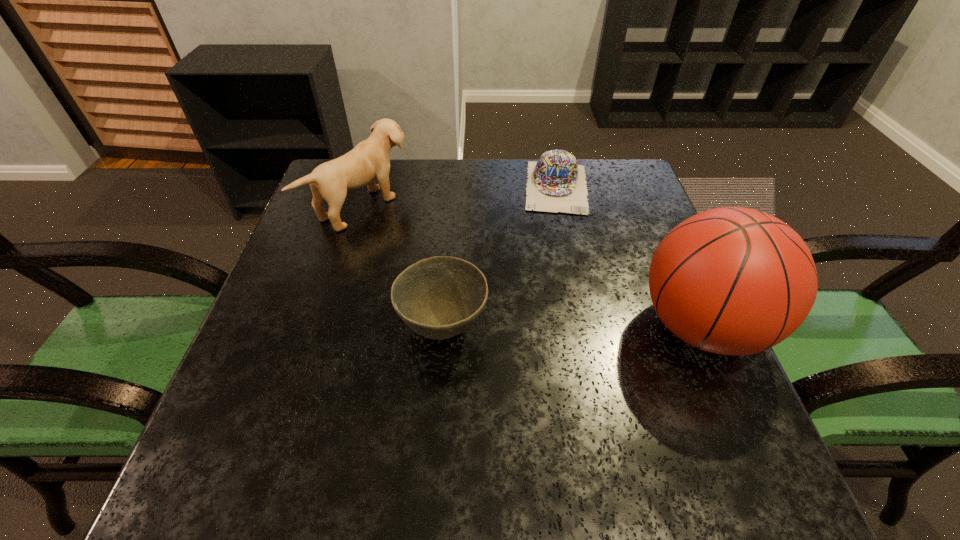
Locate an element on the screen. free space on the desktop that is between the third object from right to left and the tallest object and is positioned on the left side of the second tallest object is located at coordinates (571, 327).

At what (x,y) coordinates should I click in order to perform the action: click on free spot on the desktop that is between the second shortest object and the rightmost object and is positioned on the front, side, and top of the second object from right to left. Please return your answer as a coordinate pair (x, y). The height and width of the screenshot is (540, 960). Looking at the image, I should click on (559, 327).